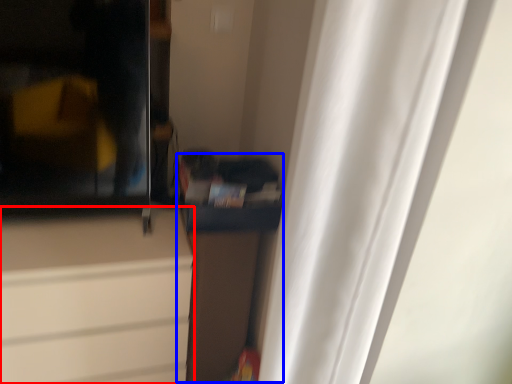
Question: Which object appears farthest to the camera in this image, cabinetry (highlighted by a red box) or cabinetry (highlighted by a blue box)?

Choices:
 (A) cabinetry
 (B) cabinetry

Answer: (B)